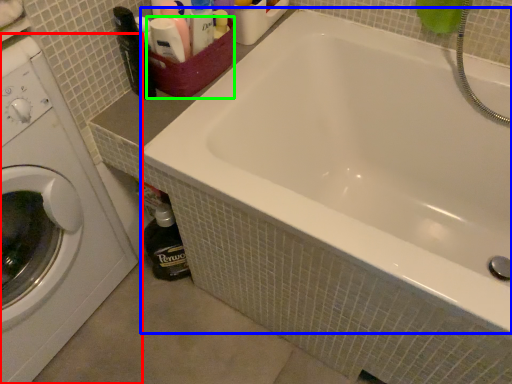
Question: Which is nearer to the washing machine (highlighted by a red box)? bathtub (highlighted by a blue box) or basket (highlighted by a green box).

Choices:
 (A) bathtub
 (B) basket

Answer: (B)